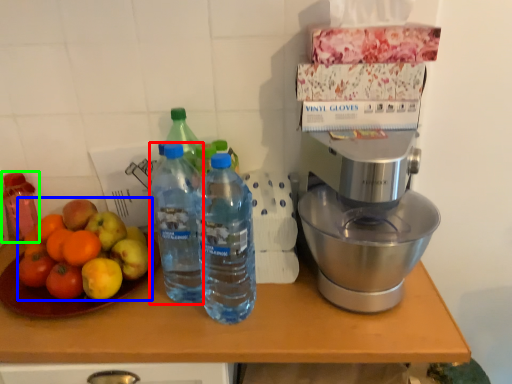
Question: Which is nearer to the bottle (highlighted by a red box)? apple (highlighted by a blue box) or bottle (highlighted by a green box).

Choices:
 (A) apple
 (B) bottle

Answer: (A)